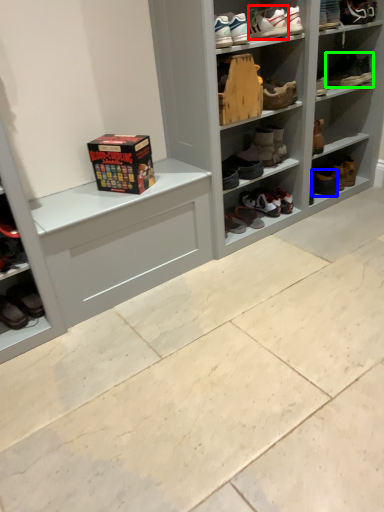
Question: Which object is the closest to the footwear (highlighted by a red box)? Choose among these: footwear (highlighted by a blue box) or footwear (highlighted by a green box).

Choices:
 (A) footwear
 (B) footwear

Answer: (B)